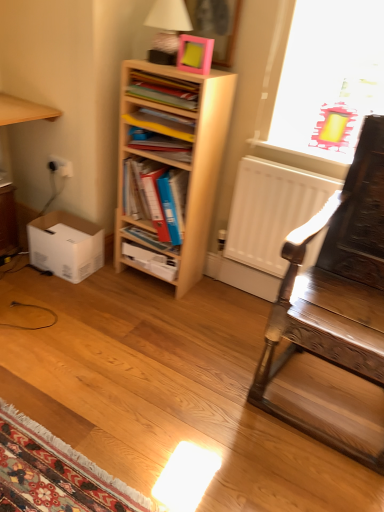
Where is `hardcover book at center, which ranks as the first book in bottom-to-top order`? The width and height of the screenshot is (384, 512). hardcover book at center, which ranks as the first book in bottom-to-top order is located at coordinates (151, 260).

Locate an element on the screen. This screenshot has width=384, height=512. matte white table lamp at upper center is located at coordinates (167, 29).

You are a GUI agent. You are given a task and a screenshot of the screen. Output one action in this format:
    pyautogui.click(x=<x>, y=<y>)
    Task: Click on the dark brown polished wood chair at right
    This screenshot has width=384, height=512.
    Given the screenshot: What is the action you would take?
    pyautogui.click(x=335, y=289)

Describe the element at coordinates (24, 110) in the screenshot. Image resolution: width=384 pixels, height=512 pixels. I see `wooden shelf at upper left` at that location.

Based on the photo, in order to face wooden shelf at upper left, should I rotate leftwards or rightwards?

Turn left by 23.865 degrees to look at wooden shelf at upper left.

Image resolution: width=384 pixels, height=512 pixels. I want to click on hardcover book at center, the 5th book positioned from the top, so click(x=151, y=260).

Does point (36, 248) come in front of point (185, 141)?

No, (36, 248) is further to viewer.

From a real-world perspective, is white cardboard box at lower left located higher than matte yellow folder at center, which is the second book from top to bottom?

No, from a real-world perspective, white cardboard box at lower left is not over matte yellow folder at center, which is the second book from top to bottom

Does white cardboard box at lower left lie in front of matte yellow folder at center, the 4th book ordered from the bottom?

No.

Can you confirm if blue hardcover book at center, which is the fourth book in top-to-bottom order, is smaller than dark brown polished wood chair at right?

Yes.

In the image, there is a blue hardcover book at center, which is the fourth book in top-to-bottom order. Where is `chair below it (from the image's perspective)`? chair below it (from the image's perspective) is located at coordinates (335, 289).

Does point (147, 237) come behind point (301, 317)?

That is True.

From a real-world perspective, is blue hardcover book at center, which is the fourth book in top-to-bottom order, physically located above or below dark brown polished wood chair at right?

blue hardcover book at center, which is the fourth book in top-to-bottom order, is situated lower than dark brown polished wood chair at right in the real world.

In terms of height, does light wood bookshelf at center look taller or shorter compared to blue hardcover book at center, which is the second book in bottom-to-top order?

Clearly, light wood bookshelf at center is taller compared to blue hardcover book at center, which is the second book in bottom-to-top order.

Considering the relative sizes of light wood bookshelf at center and blue hardcover book at center, which is the second book in bottom-to-top order, in the image provided, is light wood bookshelf at center thinner than blue hardcover book at center, which is the second book in bottom-to-top order,?

In fact, light wood bookshelf at center might be wider than blue hardcover book at center, which is the second book in bottom-to-top order.

Considering the positions of objects blue hardcover book at center, which is the second book in bottom-to-top order, and white matte radiator at center in the image provided, who is more to the right, blue hardcover book at center, which is the second book in bottom-to-top order, or white matte radiator at center?

white matte radiator at center is more to the right.

Would you say white matte radiator at center is part of blue hardcover book at center, which is the second book in bottom-to-top order,'s contents?

No, white matte radiator at center is located outside of blue hardcover book at center, which is the second book in bottom-to-top order.

Between blue hardcover book at center, which is the second book in bottom-to-top order, and white matte radiator at center, which one is positioned behind?

blue hardcover book at center, which is the second book in bottom-to-top order, is further from the camera.

Does blue hardcover book at center, which is the second book in bottom-to-top order, have a smaller size compared to white matte radiator at center?

Yes, blue hardcover book at center, which is the second book in bottom-to-top order, is smaller than white matte radiator at center.

How many degrees apart are the facing directions of blue plastic folder at center, which ranks as the third book in bottom-to-top order, and light wood bookshelf at center?

They differ by 1.24 degrees in their facing directions.

Is there a large distance between blue plastic folder at center, which ranks as the third book in bottom-to-top order, and light wood bookshelf at center?

No.

Which of these two, blue plastic folder at center, the 3th book viewed from the top, or light wood bookshelf at center, is thinner?

Thinner between the two is light wood bookshelf at center.

From the image's perspective, which is below, white cardboard box at lower left or light wood bookshelf at center?

white cardboard box at lower left is shown below in the image.

Is white cardboard box at lower left placed right next to light wood bookshelf at center?

No, white cardboard box at lower left is not touching light wood bookshelf at center.

Is light wood bookshelf at center at the back of white cardboard box at lower left?

No.

Which is in front, point (181, 67) or point (268, 401)?

The point (268, 401) is in front.

What's the angular difference between pink matte picture frame at upper center and dark brown polished wood chair at right's facing directions?

They differ by 0.00378 degrees in their facing directions.

Where is `chair located in front of the pink matte picture frame at upper center`? chair located in front of the pink matte picture frame at upper center is located at coordinates (335, 289).

Which of these two, pink matte picture frame at upper center or dark brown polished wood chair at right, is wider?

dark brown polished wood chair at right.

Where is `the 3rd book positioned above the white cardboard box at lower left (from the image's perspective)`? This screenshot has height=512, width=384. the 3rd book positioned above the white cardboard box at lower left (from the image's perspective) is located at coordinates (159, 144).

Where is `the 2nd book positioned below the dark brown polished wood chair at right (from a real-world perspective)`? the 2nd book positioned below the dark brown polished wood chair at right (from a real-world perspective) is located at coordinates (151, 239).

Estimate the real-world distances between objects in this image. Which object is further from matte yellow folder at center, the 4th book ordered from the bottom, white cardboard box at lower left or blue hardcover book at center, which is the second book in bottom-to-top order?

Among the two, white cardboard box at lower left is located further to matte yellow folder at center, the 4th book ordered from the bottom.

Considering their positions, is white matte radiator at center positioned further to dark brown polished wood chair at right than hardcover book at center, the 5th book positioned from the top?

hardcover book at center, the 5th book positioned from the top.

From the image, which object appears to be nearer to matte yellow folder at center, which is the second book from top to bottom, blue hardcover book at center, which is the fourth book in top-to-bottom order, or blue plastic folder at center, which ranks as the third book in bottom-to-top order?

blue plastic folder at center, which ranks as the third book in bottom-to-top order, is closer to matte yellow folder at center, which is the second book from top to bottom.

Based on their spatial positions, is matte white table lamp at upper center or matte plastic book at upper center, the 1th book from the top, closer to dark brown polished wood chair at right?

The object closer to dark brown polished wood chair at right is matte plastic book at upper center, the 1th book from the top.

Looking at the image, which one is located further to hardcover book at center, which ranks as the first book in bottom-to-top order, blue plastic folder at center, the 3th book viewed from the top, or matte yellow folder at center, which is the second book from top to bottom?

matte yellow folder at center, which is the second book from top to bottom, is further to hardcover book at center, which ranks as the first book in bottom-to-top order.

Looking at the image, which one is located further to matte yellow folder at center, the 4th book ordered from the bottom, white matte radiator at center or blue plastic folder at center, which ranks as the third book in bottom-to-top order?

Result: white matte radiator at center lies further to matte yellow folder at center, the 4th book ordered from the bottom, than the other object.

Which object lies nearer to the anchor point white cardboard box at lower left, wooden shelf at upper left or pink matte picture frame at upper center?

wooden shelf at upper left is closer to white cardboard box at lower left.

Based on their spatial positions, is matte white table lamp at upper center or dark brown polished wood chair at right closer to white cardboard box at lower left?

matte white table lamp at upper center is positioned closer to the anchor white cardboard box at lower left.

Where is `shelf between pink matte picture frame at upper center and white matte radiator at center in the vertical direction`? The width and height of the screenshot is (384, 512). shelf between pink matte picture frame at upper center and white matte radiator at center in the vertical direction is located at coordinates (169, 166).

The image size is (384, 512). Find the location of `box between wooden shelf at upper left and pink matte picture frame at upper center in the horizontal direction`. box between wooden shelf at upper left and pink matte picture frame at upper center in the horizontal direction is located at coordinates (66, 245).

This screenshot has width=384, height=512. Identify the location of picture frame between matte white table lamp at upper center and matte yellow folder at center, the 4th book ordered from the bottom, vertically. (195, 54).

At what (x,y) coordinates should I click in order to perform the action: click on box located between wooden shelf at upper left and matte yellow folder at center, the 4th book ordered from the bottom, in the left-right direction. Please return your answer as a coordinate pair (x, y). This screenshot has width=384, height=512. Looking at the image, I should click on (66, 245).